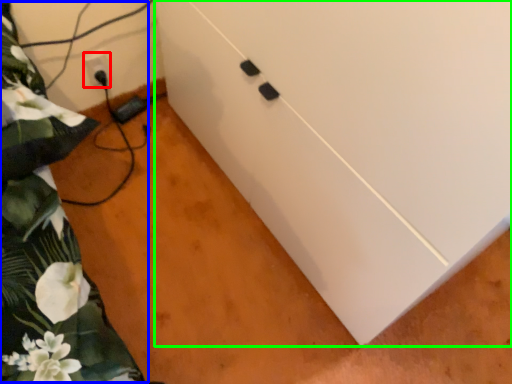
Question: Which object is positioned farthest from electric outlet (highlighted by a red box)? Select from bed (highlighted by a blue box) and cabinetry (highlighted by a green box).

Choices:
 (A) bed
 (B) cabinetry

Answer: (B)